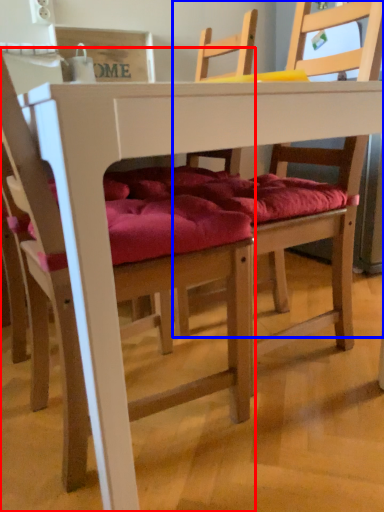
Question: Which object appears farthest to the camera in this image, chair (highlighted by a red box) or chair (highlighted by a blue box)?

Choices:
 (A) chair
 (B) chair

Answer: (B)